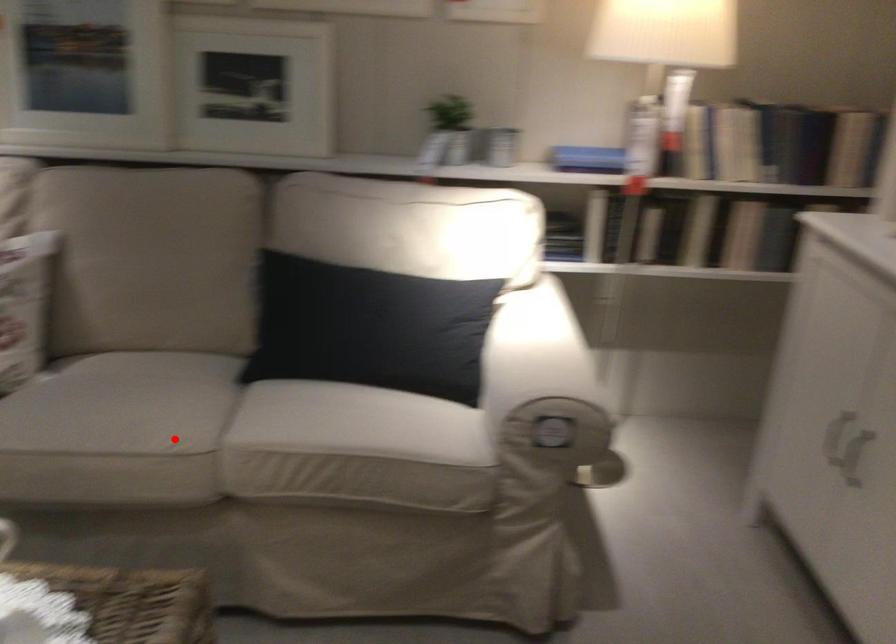
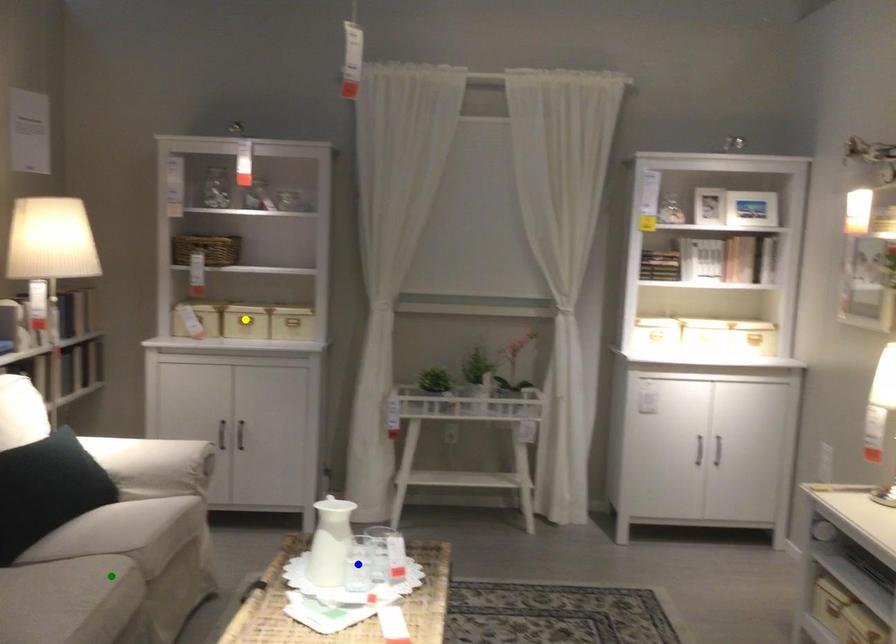
Question: I am providing you with two images of the same scene from different viewpoints. A red point is marked on the first image. You are given multiple points on the second image. Which point in image 2 is actually the same real-world point as the red point in image 1?

Choices:
 (A) green point
 (B) blue point
 (C) yellow point

Answer: (A)